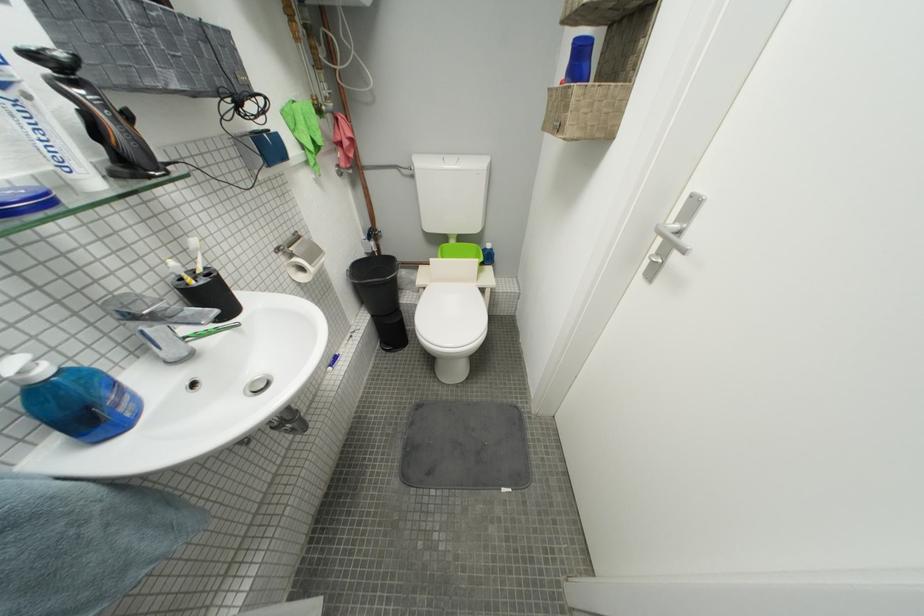
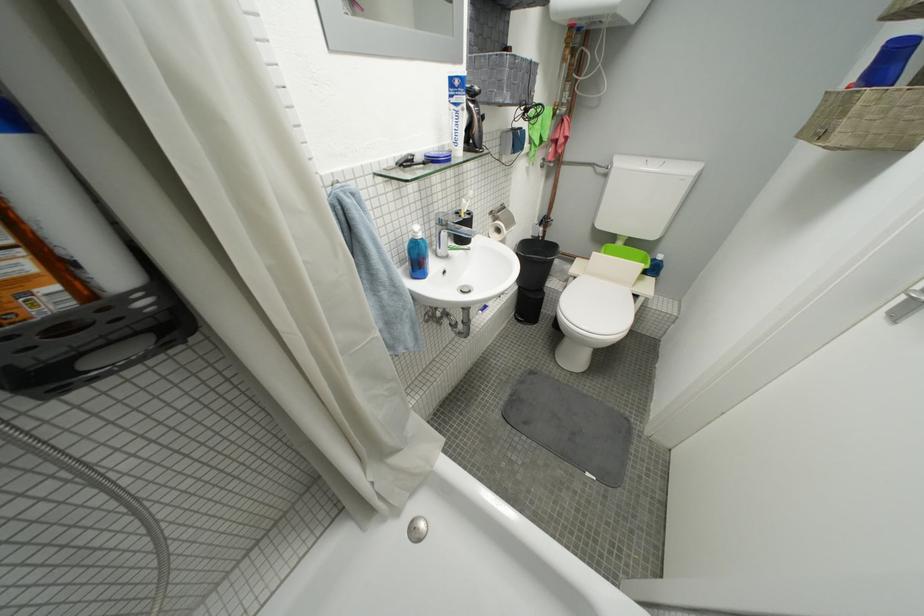
Locate, in the second image, the point that corresponds to the point at 391,353 in the first image.

(523, 322)